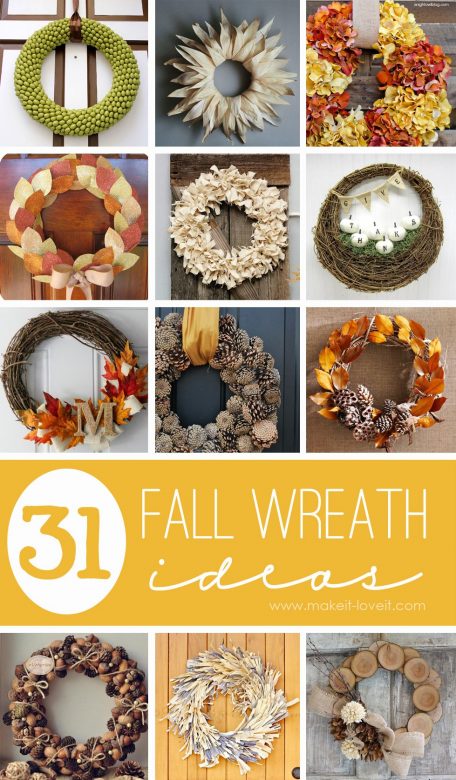
Find the location of a particular element. door is located at coordinates (130, 23).